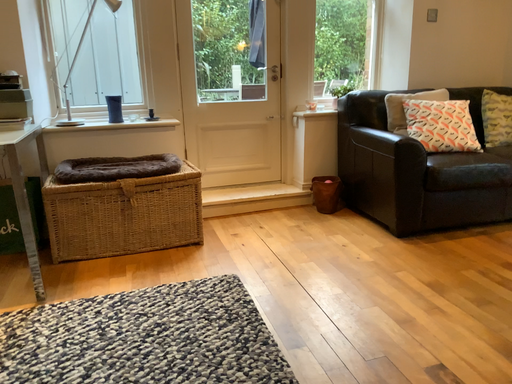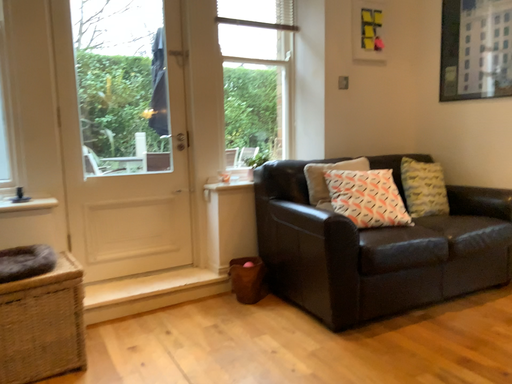
Question: How did the camera likely rotate when shooting the video?

Choices:
 (A) rotated right
 (B) rotated left

Answer: (A)